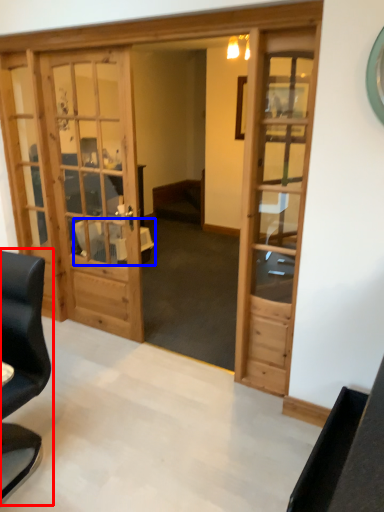
Question: Which point is closer to the camera, chair (highlighted by a red box) or table (highlighted by a blue box)?

Choices:
 (A) chair
 (B) table

Answer: (A)